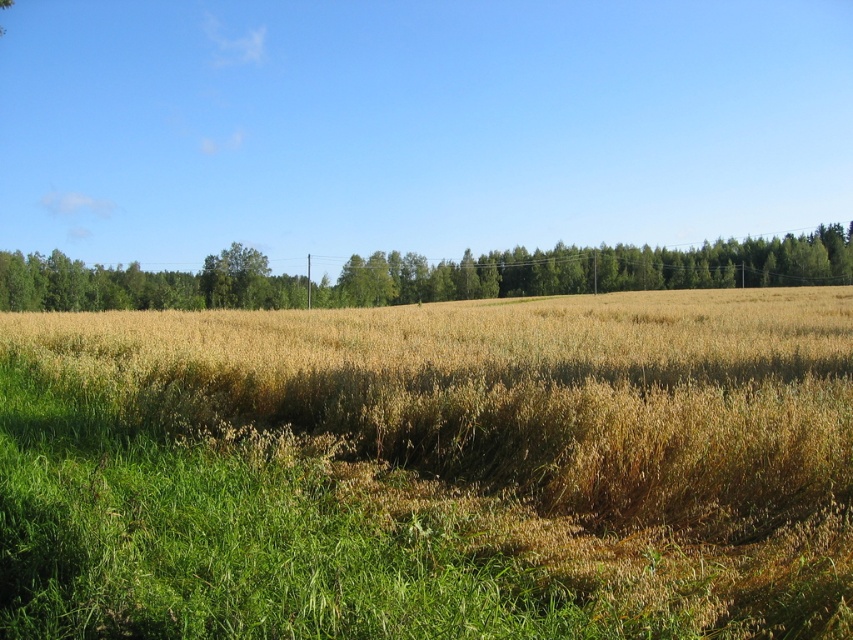
This screenshot has width=853, height=640. What do you see at coordinates (432, 468) in the screenshot?
I see `brown grassy wheat field at center` at bounding box center [432, 468].

Is point (200, 353) farther from viewer compared to point (698, 250)?

No, it is not.

Locate an element on the screen. The height and width of the screenshot is (640, 853). brown grassy wheat field at center is located at coordinates (432, 468).